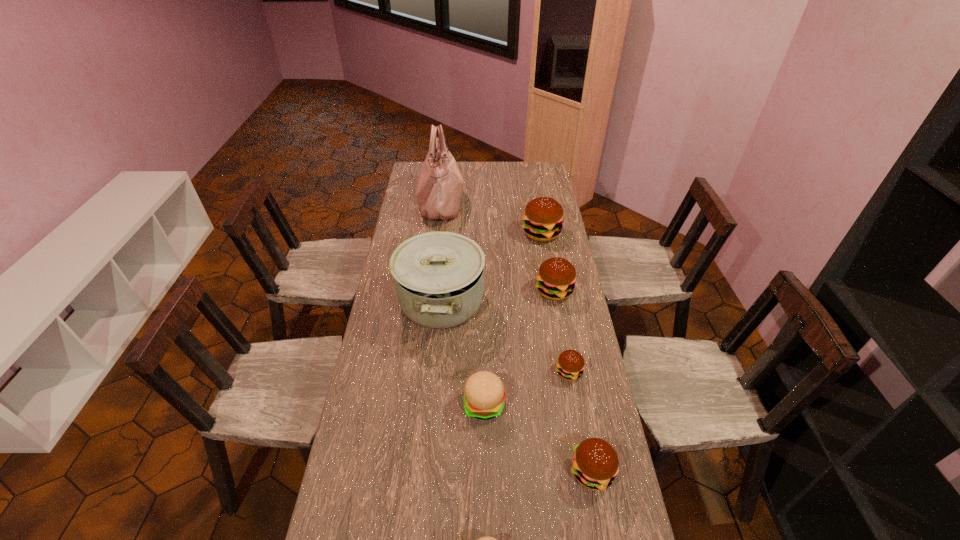
Locate an element on the screen. Image resolution: width=960 pixels, height=540 pixels. free space that satisfies the following two spatial constraints: 1. on the front side of the second tallest hamburger; 2. on the right side of the third farthest hamburger is located at coordinates (568, 372).

Where is `free space that satisfies the following two spatial constraints: 1. on the front side of the second nearest hamburger; 2. on the left side of the sixth shortest object`? free space that satisfies the following two spatial constraints: 1. on the front side of the second nearest hamburger; 2. on the left side of the sixth shortest object is located at coordinates (582, 471).

Where is `vacant space that satisfies the following two spatial constraints: 1. on the back side of the farthest hamburger; 2. at the front of the handbag with handles`? vacant space that satisfies the following two spatial constraints: 1. on the back side of the farthest hamburger; 2. at the front of the handbag with handles is located at coordinates (537, 203).